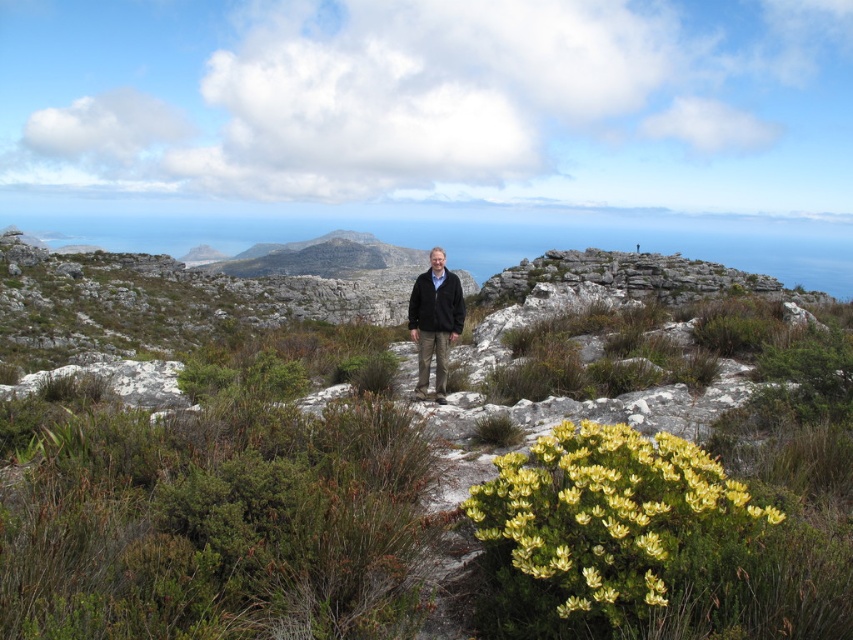
Question: Which point appears closest to the camera in this image?

Choices:
 (A) (517, 506)
 (B) (283, 371)
 (C) (430, 298)
 (D) (430, 337)

Answer: (A)

Question: Does yellow matte flower at center-right have a lesser width compared to black fleece jacket at center?

Choices:
 (A) yes
 (B) no

Answer: (B)

Question: Where is green leafy shrub at center located in relation to dark brown leather jacket at center in the image?

Choices:
 (A) right
 (B) left

Answer: (A)

Question: Considering the relative positions of yellow matte flower at center-right and dark brown leather jacket at center in the image provided, where is yellow matte flower at center-right located with respect to dark brown leather jacket at center?

Choices:
 (A) below
 (B) above

Answer: (A)

Question: Which point appears closest to the camera in this image?

Choices:
 (A) (679, 440)
 (B) (460, 289)
 (C) (467, 618)
 (D) (440, 308)

Answer: (C)

Question: Estimate the real-world distances between objects in this image. Which object is farther from the dark brown leather jacket at center?

Choices:
 (A) green leafy shrub at center
 (B) yellow matte flower at center-right
 (C) black fleece jacket at center

Answer: (B)